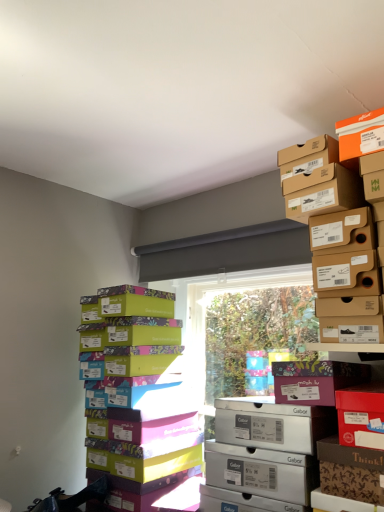
Question: From a real-world perspective, does matte brown shoebox at upper right, acting as the 1th cardboard box starting from the top, sit lower than multicolored cardboard shoebox at left?

Choices:
 (A) yes
 (B) no

Answer: (B)

Question: Is matte brown shoebox at upper right, acting as the 1th cardboard box starting from the top, positioned behind multicolored cardboard shoebox at left?

Choices:
 (A) yes
 (B) no

Answer: (B)

Question: Can you confirm if matte brown shoebox at upper right, which is the 2th cardboard box in bottom-to-top order, is wider than multicolored cardboard shoebox at left?

Choices:
 (A) yes
 (B) no

Answer: (B)

Question: Is matte brown shoebox at upper right, acting as the 1th cardboard box starting from the top, facing towards multicolored cardboard shoebox at left?

Choices:
 (A) yes
 (B) no

Answer: (B)

Question: Does matte brown shoebox at upper right, which is the 2th cardboard box in bottom-to-top order, appear on the right side of multicolored cardboard shoebox at left?

Choices:
 (A) no
 (B) yes

Answer: (B)

Question: Is matte brown shoebox at upper right, which is the 2th cardboard box in bottom-to-top order, oriented away from multicolored cardboard shoebox at left?

Choices:
 (A) yes
 (B) no

Answer: (B)

Question: Can floral-patterned cardboard box at center-right, positioned as the second cardboard box in top-to-bottom order, be found inside matte brown shoebox at upper right, which is the 2th cardboard box in bottom-to-top order?

Choices:
 (A) no
 (B) yes

Answer: (A)

Question: Does matte brown shoebox at upper right, acting as the 1th cardboard box starting from the top, have a lesser width compared to floral-patterned cardboard box at center-right, marked as the 1th cardboard box in a bottom-to-top arrangement?

Choices:
 (A) yes
 (B) no

Answer: (B)

Question: Does matte brown shoebox at upper right, acting as the 1th cardboard box starting from the top, have a smaller size compared to floral-patterned cardboard box at center-right, marked as the 1th cardboard box in a bottom-to-top arrangement?

Choices:
 (A) yes
 (B) no

Answer: (B)

Question: Does matte brown shoebox at upper right, which is the 2th cardboard box in bottom-to-top order, have a lesser height compared to floral-patterned cardboard box at center-right, positioned as the second cardboard box in top-to-bottom order?

Choices:
 (A) yes
 (B) no

Answer: (B)

Question: Is matte brown shoebox at upper right, which is the 2th cardboard box in bottom-to-top order, positioned with its back to floral-patterned cardboard box at center-right, marked as the 1th cardboard box in a bottom-to-top arrangement?

Choices:
 (A) yes
 (B) no

Answer: (B)

Question: Does matte brown shoebox at upper right, acting as the 1th cardboard box starting from the top, have a larger size compared to floral-patterned cardboard box at center-right, marked as the 1th cardboard box in a bottom-to-top arrangement?

Choices:
 (A) no
 (B) yes

Answer: (B)

Question: Is multicolored cardboard shoebox at left looking in the opposite direction of matte brown shoebox at upper right, acting as the 1th cardboard box starting from the top?

Choices:
 (A) yes
 (B) no

Answer: (B)